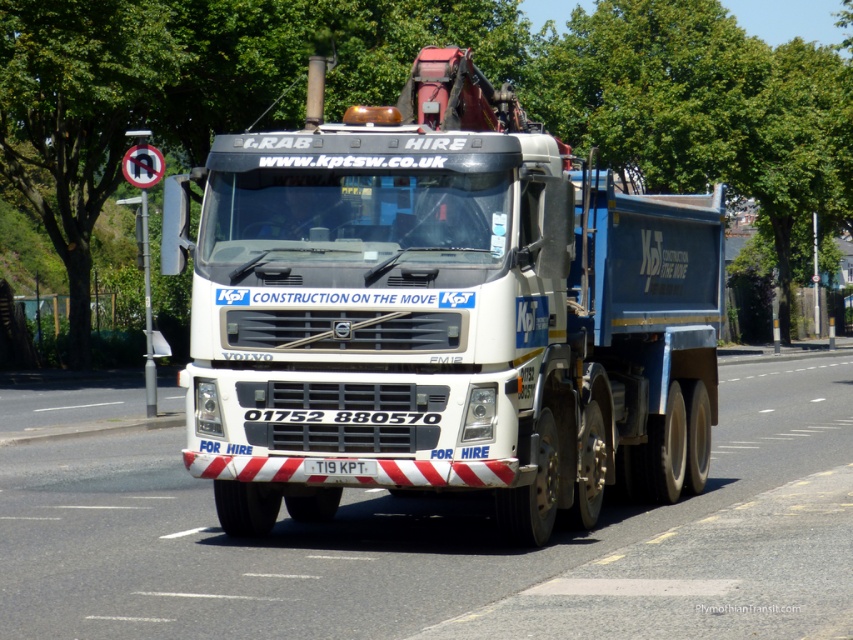
Question: Can you confirm if green leafy tree at upper left is bigger than white plastic license plate at center?

Choices:
 (A) no
 (B) yes

Answer: (B)

Question: Which object is the closest to the green leafy tree at upper center?

Choices:
 (A) white plastic license plate at center
 (B) white metallic truck at center
 (C) green leafy tree at upper left

Answer: (C)

Question: Which point is farther from the camera taking this photo?

Choices:
 (A) (367, 474)
 (B) (439, 44)

Answer: (B)

Question: Which of the following is the farthest from the observer?

Choices:
 (A) (645, 474)
 (B) (346, 461)
 (C) (242, 58)

Answer: (C)

Question: Does green leafy tree at upper center have a greater width compared to white plastic license plate at center?

Choices:
 (A) no
 (B) yes

Answer: (B)

Question: Observing the image, what is the correct spatial positioning of white metallic truck at center in reference to green leafy tree at upper center?

Choices:
 (A) right
 (B) left

Answer: (A)